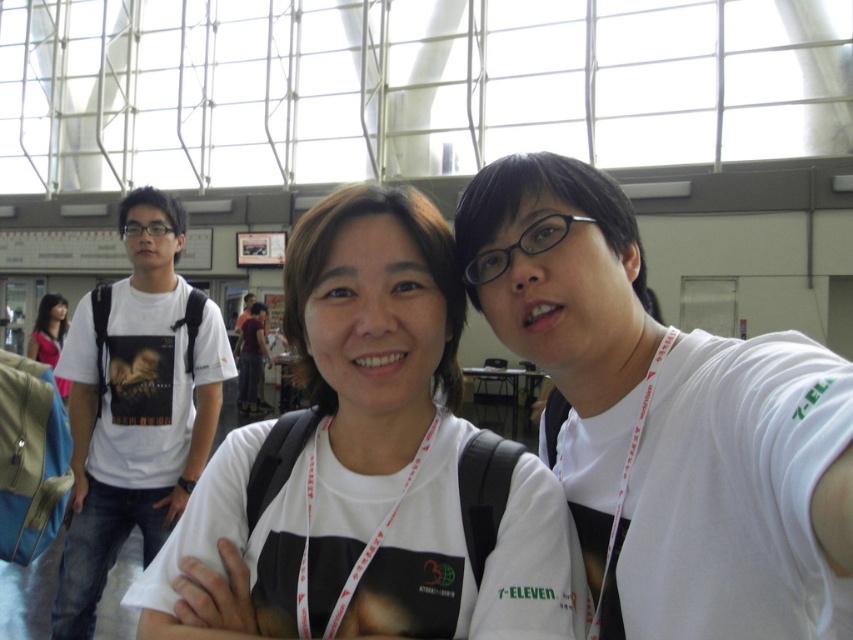
Question: Among these points, which one is nearest to the camera?

Choices:
 (A) (136, 310)
 (B) (497, 621)
 (C) (38, 310)

Answer: (B)

Question: Which point is closer to the camera?

Choices:
 (A) white t-shirt at left
 (B) white matte t-shirt at center

Answer: (B)

Question: Can you confirm if white matte t-shirt at center is thinner than white t-shirt at left?

Choices:
 (A) yes
 (B) no

Answer: (B)

Question: Observing the image, what is the correct spatial positioning of white matte t-shirt at center in reference to white t-shirt at left?

Choices:
 (A) right
 (B) left

Answer: (A)

Question: Is white matte t-shirt at center wider than matte black hair at upper left?

Choices:
 (A) yes
 (B) no

Answer: (A)

Question: Which point is closer to the camera?

Choices:
 (A) matte black hair at upper left
 (B) white matte t-shirt at center
 (C) white t-shirt at left

Answer: (B)